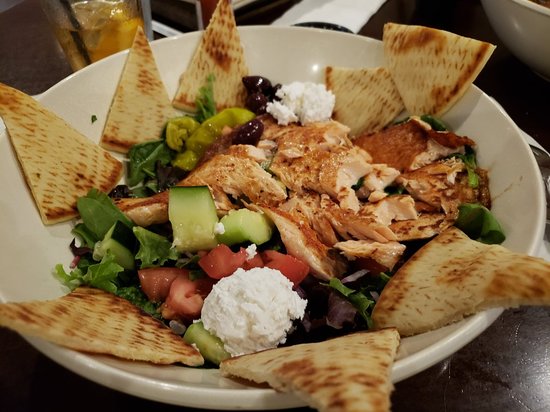
Where is `drink in glass`? Image resolution: width=550 pixels, height=412 pixels. drink in glass is located at coordinates pos(91,33).